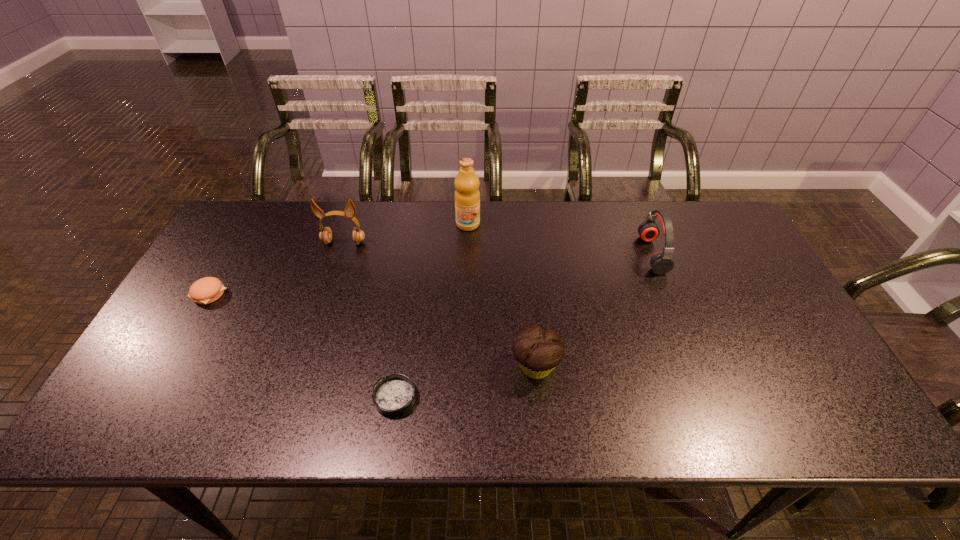
The width and height of the screenshot is (960, 540). I want to click on free spot that satisfies the following two spatial constraints: 1. on the front-facing side of the fourth tallest object; 2. on the left side of the fifth object from right to left, so click(x=304, y=367).

Where is `free point that satisfies the following two spatial constraints: 1. on the front-facing side of the fifth object from left to right; 2. on the left side of the fifth object from right to left`? The height and width of the screenshot is (540, 960). free point that satisfies the following two spatial constraints: 1. on the front-facing side of the fifth object from left to right; 2. on the left side of the fifth object from right to left is located at coordinates [304, 367].

This screenshot has width=960, height=540. In order to click on free space in the image that satisfies the following two spatial constraints: 1. on the front side of the third nearest object; 2. on the left side of the muffin in this screenshot , I will do `click(168, 367)`.

What are the coordinates of `vacant position in the image that satisfies the following two spatial constraints: 1. on the front-facing side of the ashtray; 2. on the right side of the fifth object from right to left` in the screenshot? It's located at (294, 398).